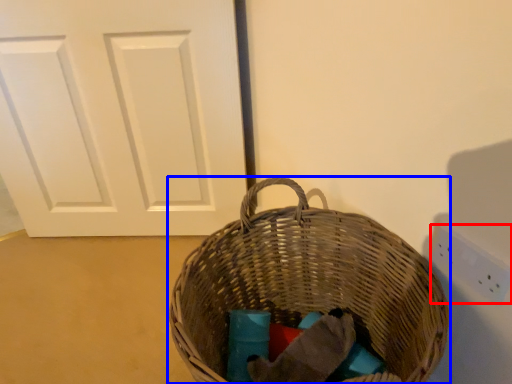
Question: Which point is further to the camera, electric outlet (highlighted by a red box) or picnic basket (highlighted by a blue box)?

Choices:
 (A) electric outlet
 (B) picnic basket

Answer: (A)